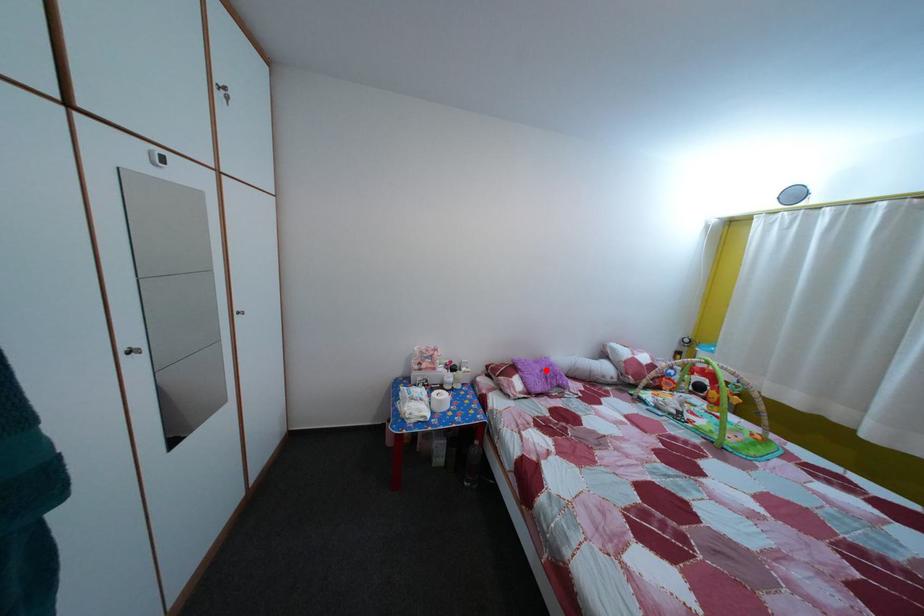
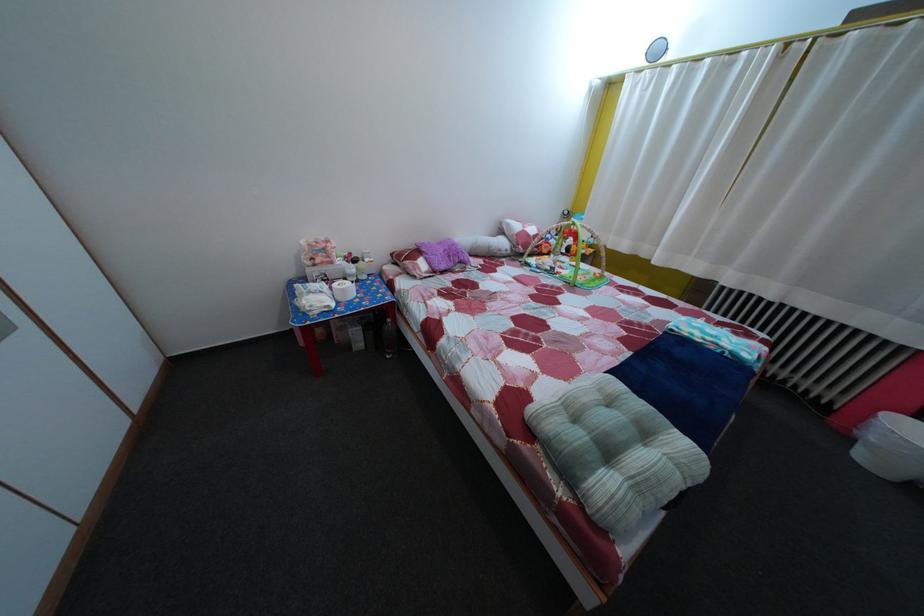
Question: I am providing you with two images of the same scene from different viewpoints. Image1 has a red point marked. In image2, the corresponding 3D location appears at what relative position? Reply with the corresponding letter.

Choices:
 (A) Closer
 (B) Farther

Answer: (A)